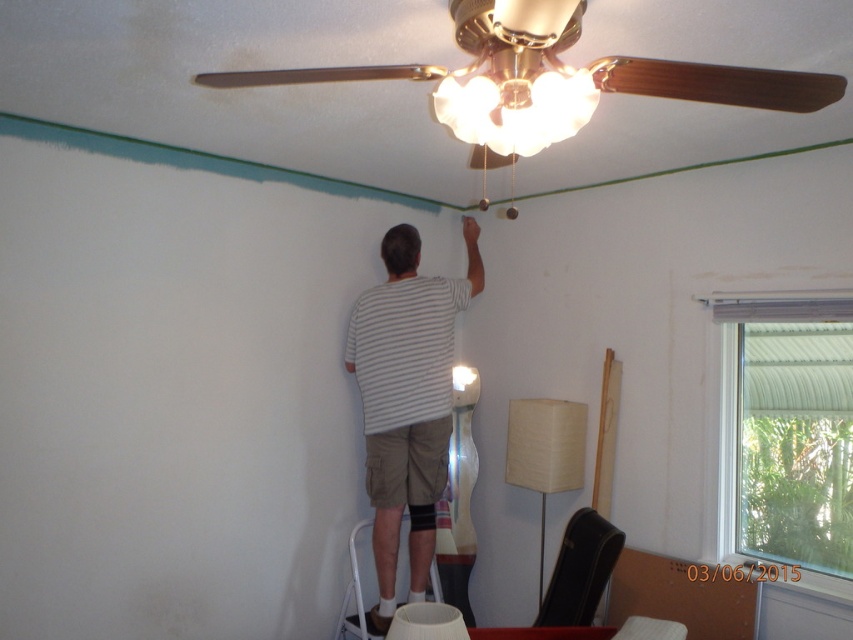
Based on the scene description, where is the beige paper lampshade at lower right located in the image?

The beige paper lampshade at lower right is located at the 2D coordinates point [544,452] in the image.

You are a painter who needs to place a beige paper lampshade at lower right on a shelf next to the white metal ladder at lower center. The shelf can only hold items up to 50 cm in width. Can the lampshade fit?

The beige paper lampshade at lower right is larger than the white metal ladder at lower center. Since the ladder is on the shelf, and the lampshade is larger, it might not fit within the 50 cm width limit. Check the lampshade dimensions before placing it.